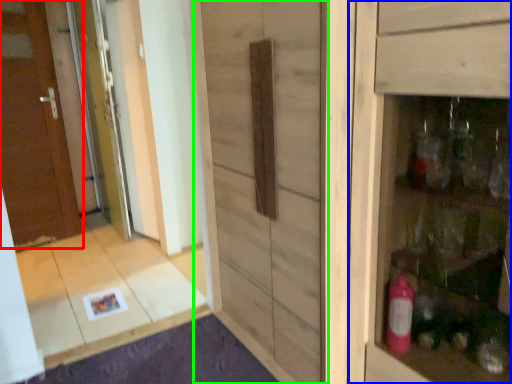
Question: Which object is positioned farthest from door (highlighted by a red box)? Select from cabinetry (highlighted by a blue box) and barn door (highlighted by a green box).

Choices:
 (A) cabinetry
 (B) barn door

Answer: (A)